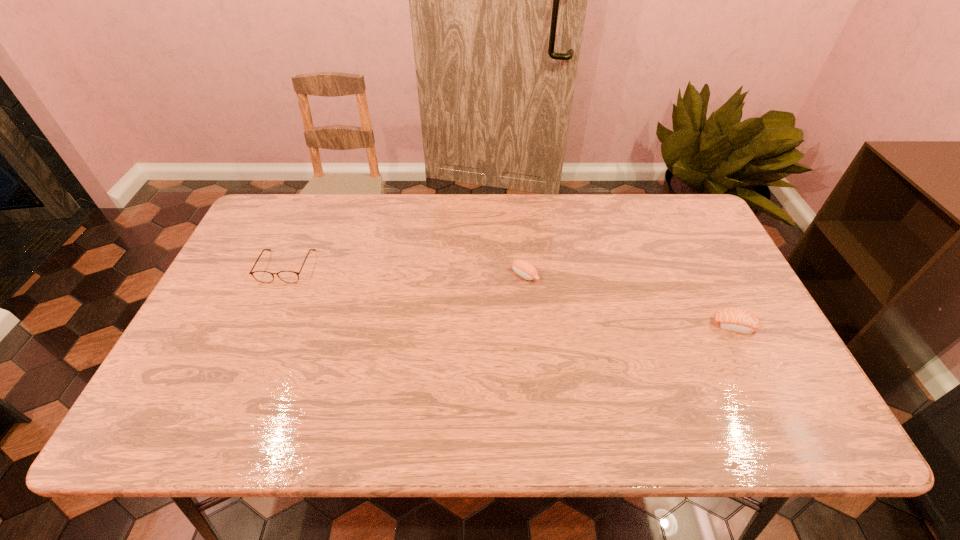
Locate an element on the screen. the leftmost object is located at coordinates (261, 276).

Identify the location of the rightmost object. The width and height of the screenshot is (960, 540). (736, 320).

Where is `the nearer sushi`? Image resolution: width=960 pixels, height=540 pixels. the nearer sushi is located at coordinates (736, 320).

I want to click on the second object from left to right, so click(x=526, y=270).

Find the location of a particular element. This screenshot has height=540, width=960. the farther sushi is located at coordinates (526, 270).

At what (x,y) coordinates should I click in order to perform the action: click on vacant position located 0.260m on the front-facing side of the leftmost object. Please return your answer as a coordinate pair (x, y). Looking at the image, I should click on (244, 363).

You are a GUI agent. You are given a task and a screenshot of the screen. Output one action in this format:
    pyautogui.click(x=<x>, y=<y>)
    Task: Click on the vacant space located on the back of the right sushi
    This screenshot has height=540, width=960.
    Given the screenshot: What is the action you would take?
    pyautogui.click(x=701, y=259)

Where is `vacant space located on the front of the second object from left to right`? vacant space located on the front of the second object from left to right is located at coordinates (530, 320).

Identify the location of object at the left edge. (261, 276).

The height and width of the screenshot is (540, 960). What are the coordinates of `object located in the right edge section of the desktop` in the screenshot? It's located at (736, 320).